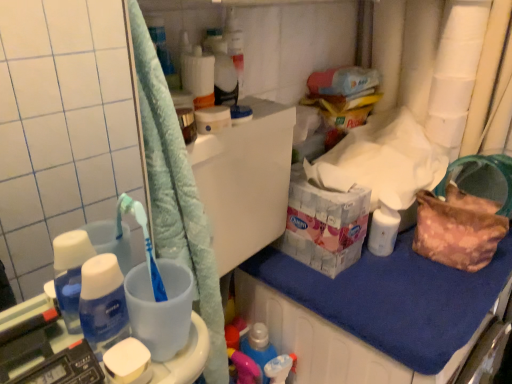
This screenshot has width=512, height=384. I want to click on free space in front of white glossy bottle at right, so click(399, 289).